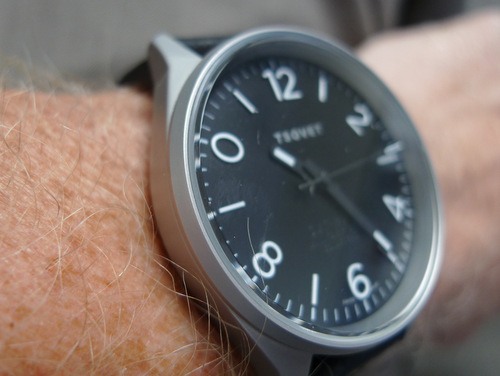
I want to click on clock, so click(338, 116).